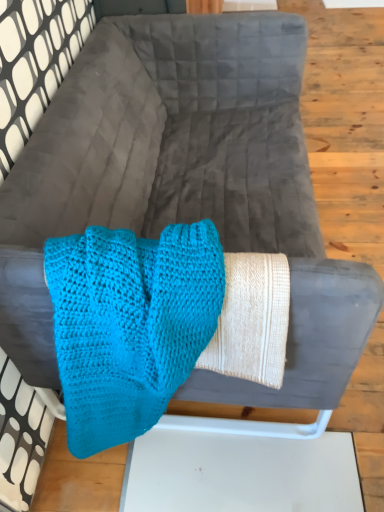
Question: Should I look upward or downward to see turquoise knitted mittens at center?

Choices:
 (A) up
 (B) down

Answer: (B)